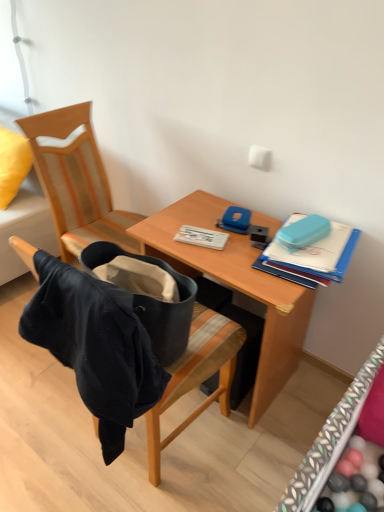
Find the location of a particular element. The width and height of the screenshot is (384, 512). vacant space in velvet black bag at center, the 2th chair from the back (from a real-world perspective) is located at coordinates (163, 437).